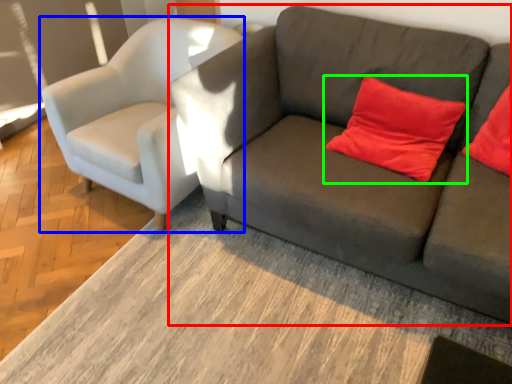
Question: Considering the real-world distances, which object is farthest from studio couch (highlighted by a red box)? chair (highlighted by a blue box) or pillow (highlighted by a green box)?

Choices:
 (A) chair
 (B) pillow

Answer: (A)